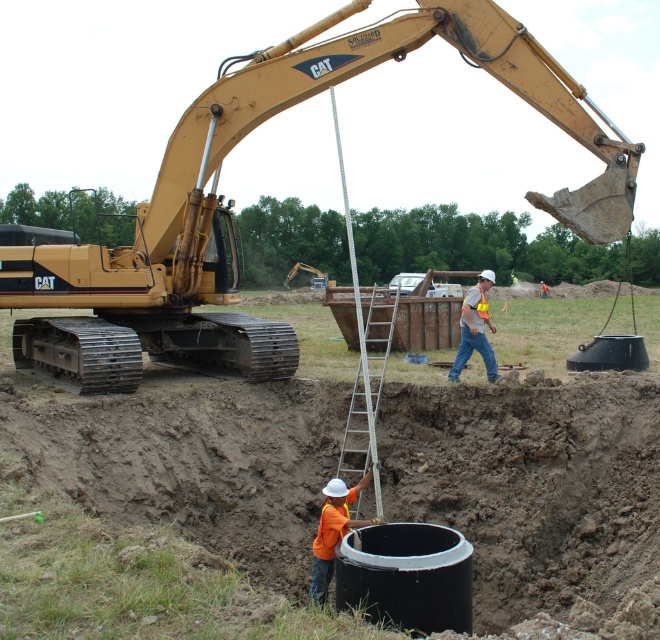
Question: Does yellow metallic excavator at upper left lie behind orange reflective vest at center?

Choices:
 (A) yes
 (B) no

Answer: (B)

Question: Among these objects, which one is farthest from the camera?

Choices:
 (A) orange fabric construction worker at lower center
 (B) silver metallic ladder at center

Answer: (B)

Question: Which object is farther from the camera taking this photo?

Choices:
 (A) yellow metallic excavator at upper left
 (B) orange fabric construction worker at lower center

Answer: (A)

Question: From the image, what is the correct spatial relationship of yellow metallic excavator at upper left in relation to silver metallic ladder at center?

Choices:
 (A) left
 (B) right

Answer: (A)

Question: In this image, where is yellow metallic excavator at upper left located relative to orange reflective vest at center?

Choices:
 (A) left
 (B) right

Answer: (A)

Question: Which object appears closest to the camera in this image?

Choices:
 (A) yellow metallic excavator at upper left
 (B) silver metallic ladder at center

Answer: (A)